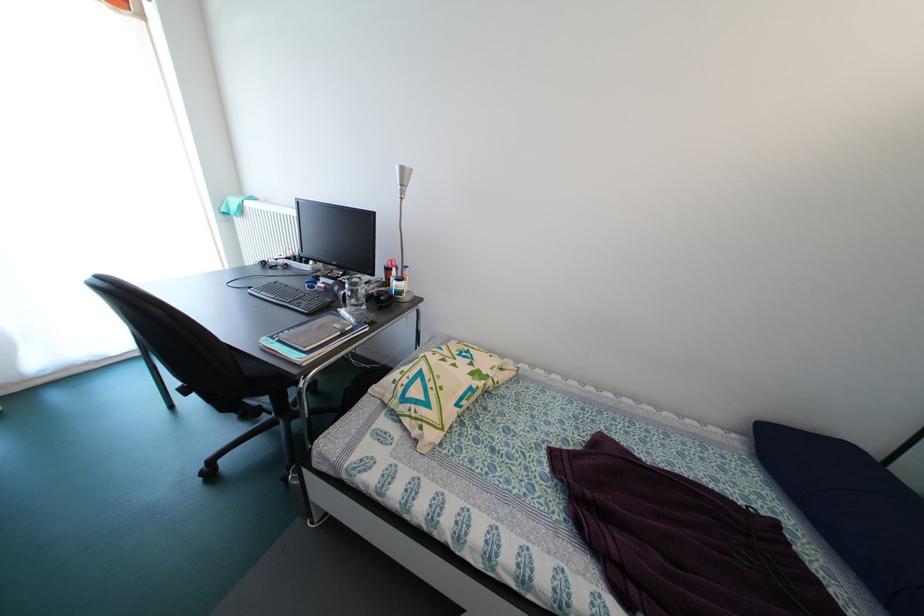
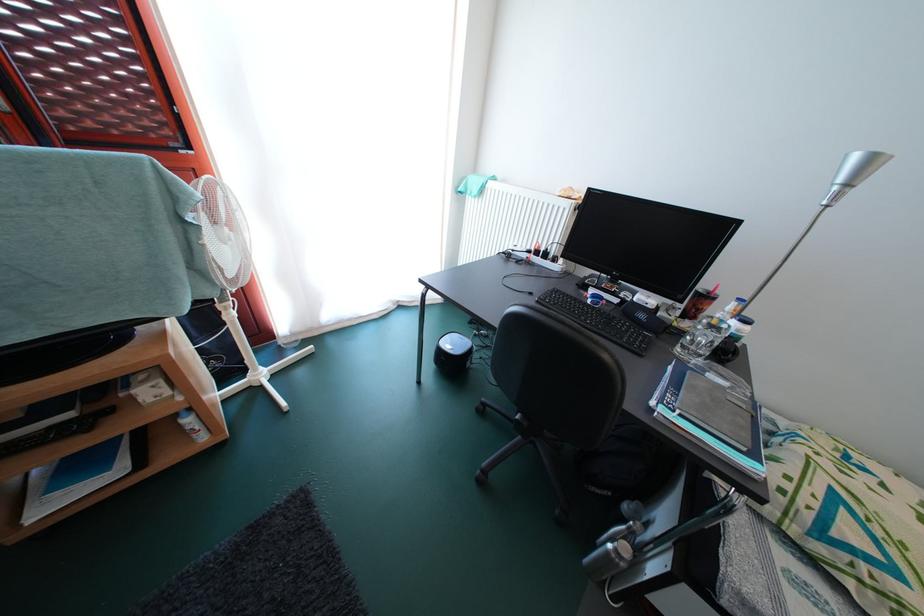
Question: The images are taken continuously from a first-person perspective. In which direction are you moving?

Choices:
 (A) Left
 (B) Right
 (C) Forward
 (D) Backward

Answer: (A)